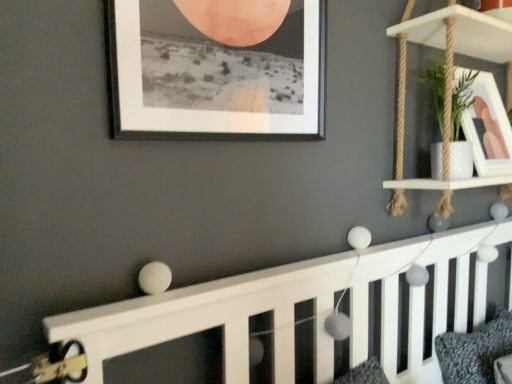
In order to face black matte picture frame at upper center, positioned as the 1th picture frame in front-to-back order, should I rotate leftwards or rightwards?

You should rotate left by 2.386 degrees.

This screenshot has height=384, width=512. Describe the element at coordinates (475, 349) in the screenshot. I see `textured gray pillow at lower right` at that location.

Image resolution: width=512 pixels, height=384 pixels. I want to click on white glossy picture frame at upper right, marked as the first picture frame in a back-to-front arrangement, so click(488, 128).

In order to click on black matte picture frame at upper center, the first picture frame positioned from the left in this screenshot , I will do `click(214, 76)`.

From the image's perspective, which one is positioned lower, white wood shelf at upper right or textured gray pillow at lower right?

From the image's view, textured gray pillow at lower right is below.

Are white wood shelf at upper right and textured gray pillow at lower right located far from each other?

They are positioned close to each other.

From the picture: Is white wood shelf at upper right in front of or behind textured gray pillow at lower right in the image?

Visually, white wood shelf at upper right is located in front of textured gray pillow at lower right.

Is black matte picture frame at upper center, which is the second picture frame from right to left, taller than textured gray pillow at lower right?

Indeed, black matte picture frame at upper center, which is the second picture frame from right to left, has a greater height compared to textured gray pillow at lower right.

Considering the points (213, 95) and (448, 375), which point is behind, point (213, 95) or point (448, 375)?

Positioned behind is point (448, 375).

Do you think black matte picture frame at upper center, positioned as the 2th picture frame in back-to-front order, is within textured gray pillow at lower right, or outside of it?

black matte picture frame at upper center, positioned as the 2th picture frame in back-to-front order, is not enclosed by textured gray pillow at lower right.

Considering the relative sizes of white wood shelf at upper right and black matte picture frame at upper center, which is the second picture frame from right to left, in the image provided, is white wood shelf at upper right bigger than black matte picture frame at upper center, which is the second picture frame from right to left,?

Yes, white wood shelf at upper right is bigger than black matte picture frame at upper center, which is the second picture frame from right to left.

From the image's perspective, is white wood shelf at upper right positioned above or below black matte picture frame at upper center, which is the second picture frame from right to left?

From the image's perspective, white wood shelf at upper right appears above black matte picture frame at upper center, which is the second picture frame from right to left.

Is white wood shelf at upper right not inside black matte picture frame at upper center, which is the second picture frame from right to left?

Yes, white wood shelf at upper right is not within black matte picture frame at upper center, which is the second picture frame from right to left.

Considering the relative sizes of white wood shelf at upper right and black matte picture frame at upper center, positioned as the 2th picture frame in back-to-front order, in the image provided, is white wood shelf at upper right thinner than black matte picture frame at upper center, positioned as the 2th picture frame in back-to-front order,?

No, white wood shelf at upper right is not thinner than black matte picture frame at upper center, positioned as the 2th picture frame in back-to-front order.

Which of these two, textured gray pillow at lower right or white wood shelf at upper right, stands shorter?

textured gray pillow at lower right is shorter.

Based on the photo, relative to white wood shelf at upper right, is textured gray pillow at lower right in front or behind?

Visually, textured gray pillow at lower right is located behind white wood shelf at upper right.

Does textured gray pillow at lower right turn towards white wood shelf at upper right?

No, textured gray pillow at lower right does not turn towards white wood shelf at upper right.

Looking at this image, considering the sizes of objects textured gray pillow at lower right and white wood shelf at upper right in the image provided, who is wider, textured gray pillow at lower right or white wood shelf at upper right?

textured gray pillow at lower right is wider.

Considering the sizes of objects textured gray pillow at lower right and black matte picture frame at upper center, positioned as the 2th picture frame in back-to-front order, in the image provided, who is thinner, textured gray pillow at lower right or black matte picture frame at upper center, positioned as the 2th picture frame in back-to-front order,?

black matte picture frame at upper center, positioned as the 2th picture frame in back-to-front order.

From a real-world perspective, is textured gray pillow at lower right physically below black matte picture frame at upper center, positioned as the 2th picture frame in back-to-front order?

Yes, from a real-world perspective, textured gray pillow at lower right is beneath black matte picture frame at upper center, positioned as the 2th picture frame in back-to-front order.

Looking at this image, is textured gray pillow at lower right inside or outside of black matte picture frame at upper center, positioned as the 1th picture frame in front-to-back order?

textured gray pillow at lower right is outside black matte picture frame at upper center, positioned as the 1th picture frame in front-to-back order.

Does textured gray pillow at lower right come in front of black matte picture frame at upper center, the first picture frame positioned from the left?

No, textured gray pillow at lower right is behind black matte picture frame at upper center, the first picture frame positioned from the left.

Is white wood shelf at upper right further to camera compared to white glossy picture frame at upper right, acting as the 2th picture frame starting from the front?

No, it is in front of white glossy picture frame at upper right, acting as the 2th picture frame starting from the front.

In the image, is white wood shelf at upper right on the left side or the right side of white glossy picture frame at upper right, marked as the first picture frame in a back-to-front arrangement?

Based on their positions, white wood shelf at upper right is located to the right of white glossy picture frame at upper right, marked as the first picture frame in a back-to-front arrangement.

From a real-world perspective, is white wood shelf at upper right physically located above or below white glossy picture frame at upper right, arranged as the 2th picture frame when viewed from the left?

Clearly, from a real-world perspective, white wood shelf at upper right is above white glossy picture frame at upper right, arranged as the 2th picture frame when viewed from the left.

Could you tell me if black matte picture frame at upper center, positioned as the 1th picture frame in front-to-back order, is turned towards white glossy picture frame at upper right, arranged as the 2th picture frame when viewed from the left?

No, black matte picture frame at upper center, positioned as the 1th picture frame in front-to-back order, does not turn towards white glossy picture frame at upper right, arranged as the 2th picture frame when viewed from the left.

Which point is more distant from viewer, (114,134) or (479,76)?

Positioned behind is point (479,76).

Considering the positions of objects black matte picture frame at upper center, positioned as the 2th picture frame in back-to-front order, and white glossy picture frame at upper right, acting as the 2th picture frame starting from the front, in the image provided, who is more to the right, black matte picture frame at upper center, positioned as the 2th picture frame in back-to-front order, or white glossy picture frame at upper right, acting as the 2th picture frame starting from the front,?

white glossy picture frame at upper right, acting as the 2th picture frame starting from the front, is more to the right.

In terms of width, does black matte picture frame at upper center, which is the second picture frame from right to left, look wider or thinner when compared to white glossy picture frame at upper right, arranged as the 2th picture frame when viewed from the left?

black matte picture frame at upper center, which is the second picture frame from right to left, is thinner than white glossy picture frame at upper right, arranged as the 2th picture frame when viewed from the left.

This screenshot has height=384, width=512. In the image, there is a textured gray pillow at lower right. Identify the location of shelf above it (from the image's perspective). (461, 35).

Image resolution: width=512 pixels, height=384 pixels. Identify the location of pillow directly beneath the black matte picture frame at upper center, positioned as the 1th picture frame in front-to-back order (from a real-world perspective). (475, 349).

Which object lies nearer to the anchor point white wood shelf at upper right, textured gray pillow at lower right or black matte picture frame at upper center, which is the second picture frame from right to left?

Among the two, black matte picture frame at upper center, which is the second picture frame from right to left, is located nearer to white wood shelf at upper right.

From the image, which object appears to be farther from textured gray pillow at lower right, white glossy picture frame at upper right, arranged as the 2th picture frame when viewed from the left, or black matte picture frame at upper center, which is the second picture frame from right to left?

black matte picture frame at upper center, which is the second picture frame from right to left, lies further to textured gray pillow at lower right than the other object.

Which object lies nearer to the anchor point white glossy picture frame at upper right, acting as the 2th picture frame starting from the front, textured gray pillow at lower right or white wood shelf at upper right?

Among the two, white wood shelf at upper right is located nearer to white glossy picture frame at upper right, acting as the 2th picture frame starting from the front.

Estimate the real-world distances between objects in this image. Which object is closer to black matte picture frame at upper center, positioned as the 1th picture frame in front-to-back order, white wood shelf at upper right or white glossy picture frame at upper right, positioned as the 1th picture frame in right-to-left order?

white wood shelf at upper right lies closer to black matte picture frame at upper center, positioned as the 1th picture frame in front-to-back order, than the other object.

Which object lies nearer to the anchor point black matte picture frame at upper center, positioned as the 1th picture frame in front-to-back order, textured gray pillow at lower right or white glossy picture frame at upper right, arranged as the 2th picture frame when viewed from the left?

white glossy picture frame at upper right, arranged as the 2th picture frame when viewed from the left.

Looking at the image, which one is located further to black matte picture frame at upper center, positioned as the 1th picture frame in front-to-back order, white glossy picture frame at upper right, acting as the 2th picture frame starting from the front, or white wood shelf at upper right?

white glossy picture frame at upper right, acting as the 2th picture frame starting from the front, lies further to black matte picture frame at upper center, positioned as the 1th picture frame in front-to-back order, than the other object.

Based on their spatial positions, is textured gray pillow at lower right or white glossy picture frame at upper right, acting as the 2th picture frame starting from the front, closer to white wood shelf at upper right?

white glossy picture frame at upper right, acting as the 2th picture frame starting from the front.

From the image, which object appears to be farther from textured gray pillow at lower right, black matte picture frame at upper center, which is the second picture frame from right to left, or white wood shelf at upper right?

black matte picture frame at upper center, which is the second picture frame from right to left, lies further to textured gray pillow at lower right than the other object.

Find the location of a particular element. The width and height of the screenshot is (512, 384). picture frame situated between black matte picture frame at upper center, which is the second picture frame from right to left, and white wood shelf at upper right from left to right is located at coordinates (488, 128).

Where is `picture frame between black matte picture frame at upper center, the first picture frame positioned from the left, and textured gray pillow at lower right vertically`? The width and height of the screenshot is (512, 384). picture frame between black matte picture frame at upper center, the first picture frame positioned from the left, and textured gray pillow at lower right vertically is located at coordinates (488, 128).